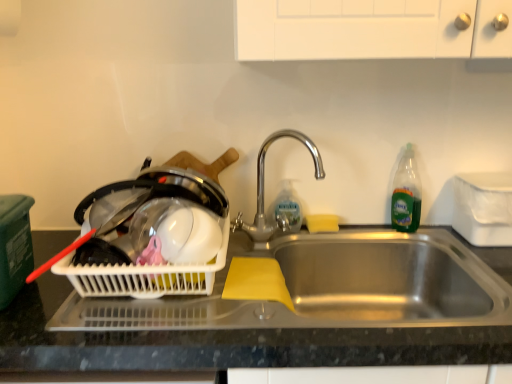
Identify the location of vacant area in front of clear plastic bottle at sink, which is the second bottle from right to left. The image size is (512, 384). (281, 241).